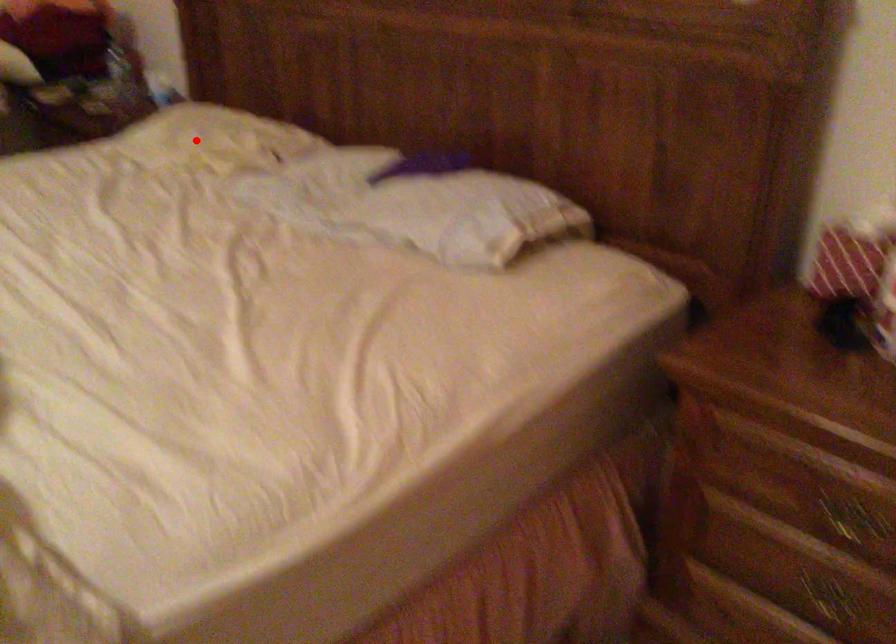
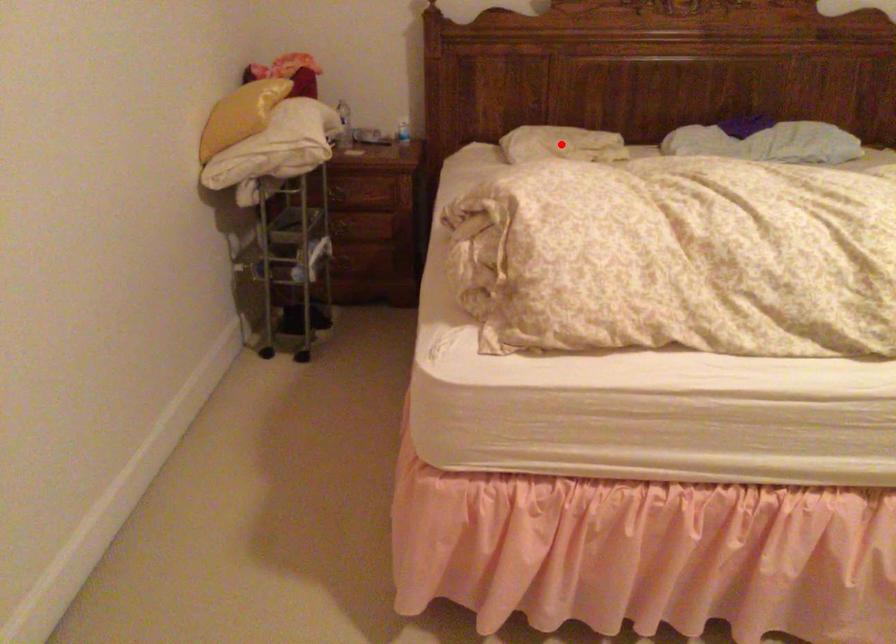
I am providing you with two images of the same scene from different viewpoints. A red point is marked on the first image and another point is marked on the second image. Is the red point in image1 aligned with the point shown in image2?

Yes